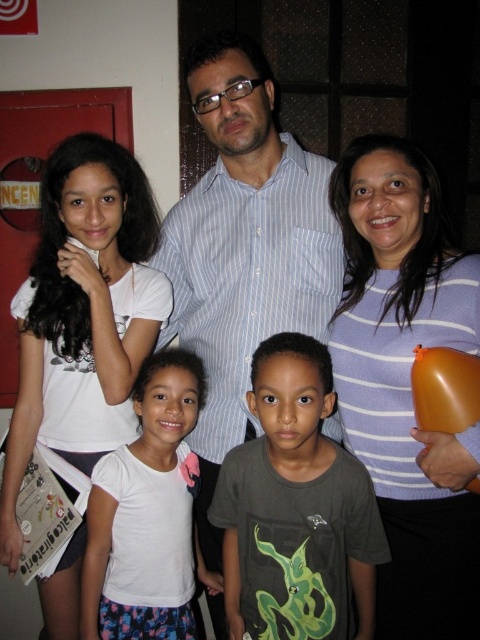
Based on the coordinates provided, which object in the scene is located at point (407, 381)?

The point (407, 381) corresponds to the purple striped sweater at upper right.